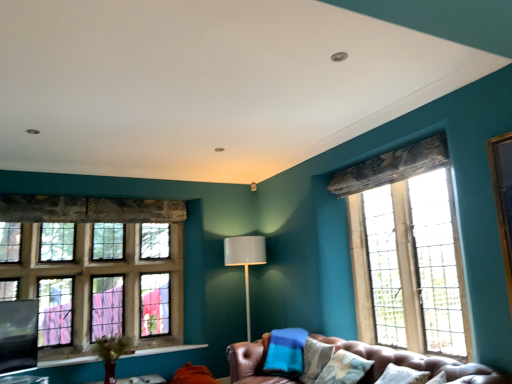
Question: Should I look upward or downward to see black matte window screen at lower left?

Choices:
 (A) down
 (B) up

Answer: (A)

Question: Can you confirm if wooden table at lower center is smaller than clear glass window at right, which is counted as the 2th window, starting from the back?

Choices:
 (A) no
 (B) yes

Answer: (B)

Question: Is wooden table at lower center in front of clear glass window at right, which is counted as the 2th window, starting from the back?

Choices:
 (A) yes
 (B) no

Answer: (B)

Question: Is wooden table at lower center shorter than clear glass window at right, which is counted as the 2th window, starting from the back?

Choices:
 (A) yes
 (B) no

Answer: (A)

Question: From a real-world perspective, is wooden table at lower center on clear glass window at right, acting as the 1th window starting from the right?

Choices:
 (A) yes
 (B) no

Answer: (B)

Question: Is wooden table at lower center to the left of clear glass window at right, which is counted as the 2th window, starting from the back, from the viewer's perspective?

Choices:
 (A) no
 (B) yes

Answer: (B)

Question: Does wooden table at lower center have a greater width compared to clear glass window at right, which is counted as the 2th window, starting from the back?

Choices:
 (A) yes
 (B) no

Answer: (A)

Question: Considering the relative positions of black matte window screen at lower left and stained glass window at left, marked as the second window in a front-to-back arrangement, in the image provided, is black matte window screen at lower left behind stained glass window at left, marked as the second window in a front-to-back arrangement,?

Choices:
 (A) yes
 (B) no

Answer: (B)

Question: Is black matte window screen at lower left turned away from stained glass window at left, which is counted as the second window, starting from the right?

Choices:
 (A) yes
 (B) no

Answer: (B)

Question: Is black matte window screen at lower left taller than stained glass window at left, the 1th window from the left?

Choices:
 (A) no
 (B) yes

Answer: (A)

Question: Is black matte window screen at lower left directly adjacent to stained glass window at left, which is counted as the second window, starting from the right?

Choices:
 (A) yes
 (B) no

Answer: (B)

Question: Are black matte window screen at lower left and stained glass window at left, marked as the second window in a front-to-back arrangement, far apart?

Choices:
 (A) no
 (B) yes

Answer: (A)

Question: Can you confirm if black matte window screen at lower left is smaller than stained glass window at left, marked as the second window in a front-to-back arrangement?

Choices:
 (A) yes
 (B) no

Answer: (A)

Question: Does stained glass window at left, which is counted as the second window, starting from the right, turn towards matte gray lamp at center?

Choices:
 (A) no
 (B) yes

Answer: (A)